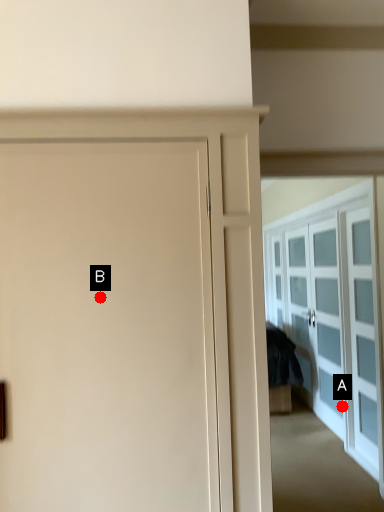
Question: Two points are circled on the image, labeled by A and B beside each circle. Among these points, which one is nearest to the camera?

Choices:
 (A) A is closer
 (B) B is closer

Answer: (B)